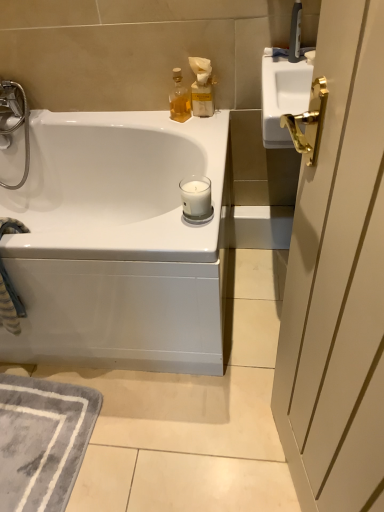
Locate an element on the screen. This screenshot has width=384, height=512. vacant space to the left of matte beige bottle at upper right is located at coordinates (166, 121).